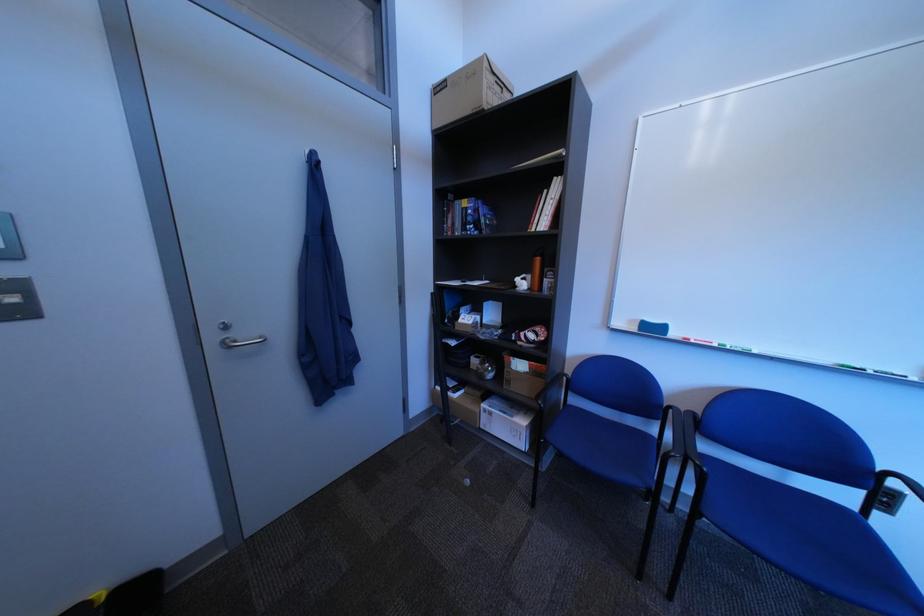
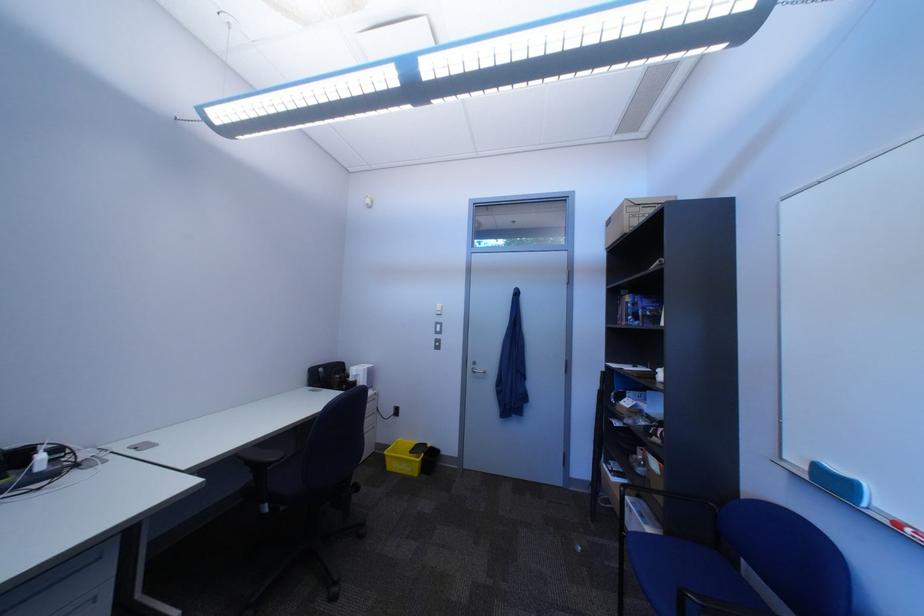
Locate, in the second image, the point that corresponds to point (704, 342) in the first image.

(915, 527)